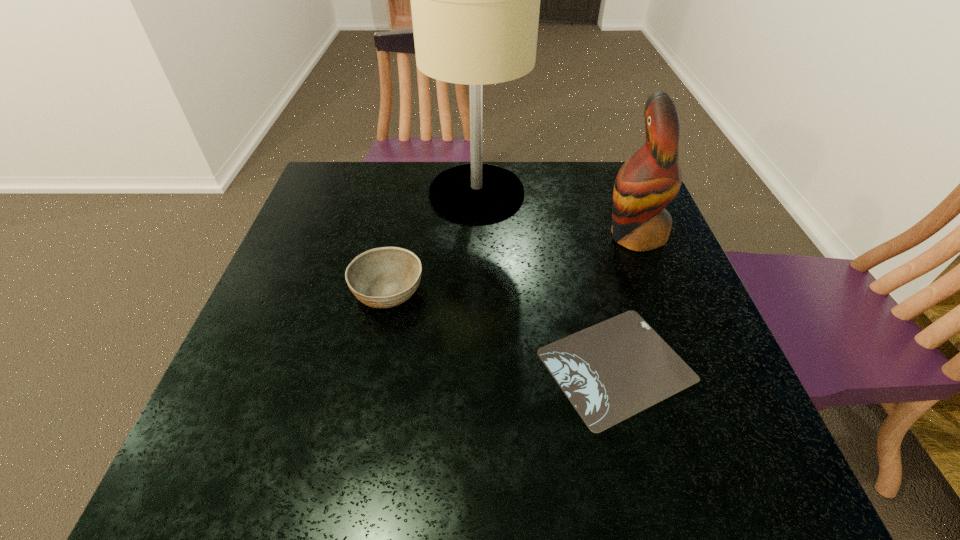
Find the location of a particular element. object at the far edge is located at coordinates (475, 0).

I want to click on parrot present at the right edge, so pos(647,182).

I want to click on mousepad that is at the right edge, so click(609, 372).

You are a GUI agent. You are given a task and a screenshot of the screen. Output one action in this format:
    pyautogui.click(x=<x>, y=<y>)
    Task: Click on the free space at the far edge of the desktop
    
    Given the screenshot: What is the action you would take?
    pyautogui.click(x=557, y=200)

Where is `free space at the near edge of the desktop`? Image resolution: width=960 pixels, height=540 pixels. free space at the near edge of the desktop is located at coordinates 428,444.

The height and width of the screenshot is (540, 960). Identify the location of vacant space at the left edge of the desktop. (334, 245).

Where is `vacant area at the right edge`? vacant area at the right edge is located at coordinates (637, 260).

At what (x,y) coordinates should I click in order to perform the action: click on free space at the near left corner. Please return your answer as a coordinate pair (x, y). Looking at the image, I should click on (202, 456).

Locate an element on the screen. Image resolution: width=960 pixels, height=540 pixels. vacant region between the second shortest object and the tallest object is located at coordinates (432, 242).

Identify the location of blank region between the mousepad and the table lamp. (546, 279).